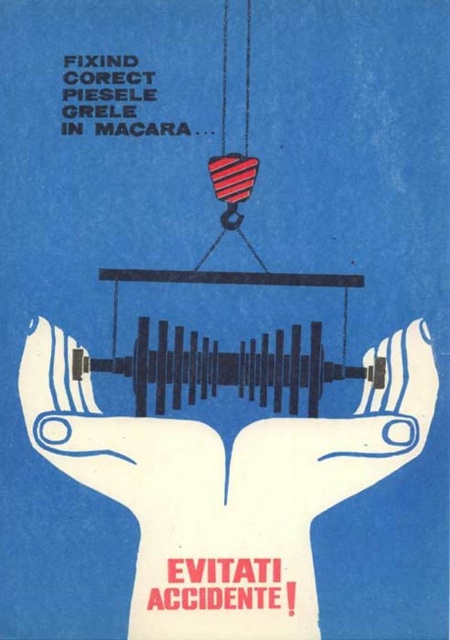
You are an observer looking at the safety poster. You notice two objects labeled as white matte hands at center and white matte hand at center. Which one is positioned lower in the image?

The white matte hands at center is located below the white matte hand at center, so it is positioned lower in the image.

Consider the image. You are an inspector checking the safety of the crane hook setup. The two points marked at point (414, 340) need to be a minimum of 1.5 meters apart to comply with safety regulations. Are they compliant?

The two points marked at point (414, 340) are 1.22 meters apart, which is less than the required 1.5 meters. Therefore, they are not compliant with safety regulations.